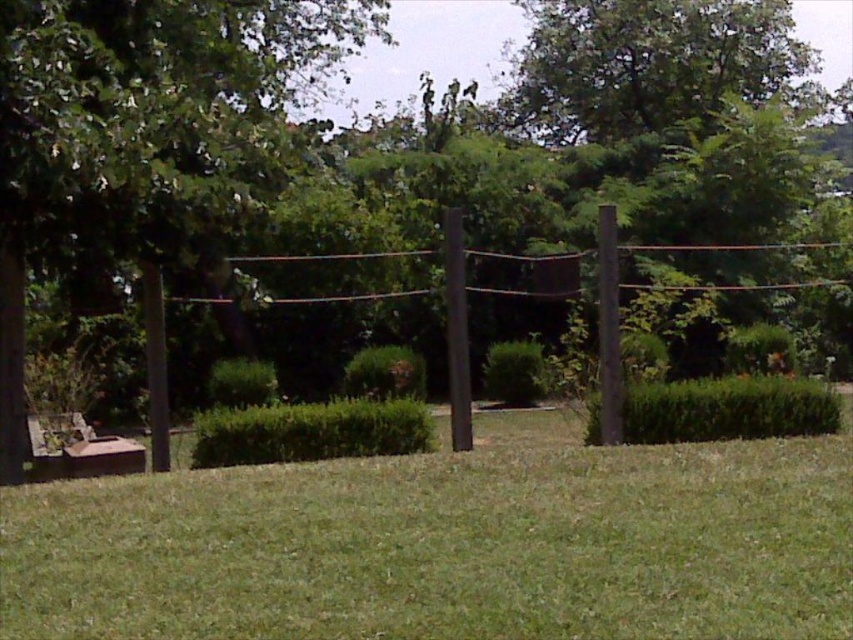
How distant is black matte telegraph pole at center from brown wooden telegraph pole at right?

black matte telegraph pole at center is 4.59 meters away from brown wooden telegraph pole at right.

Is black matte telegraph pole at center thinner than brown wooden telegraph pole at right?

No, black matte telegraph pole at center is not thinner than brown wooden telegraph pole at right.

Who is more forward, [457,337] or [601,406]?

Point [457,337] is more forward.

The width and height of the screenshot is (853, 640). Identify the location of black matte telegraph pole at center. (457, 332).

Does point (3, 310) come farther from viewer compared to point (141, 269)?

That is False.

Which of these two, green leafy tree at left or smooth brown post at left, stands taller?

With more height is green leafy tree at left.

Between point (231, 176) and point (165, 458), which one is positioned in front?

Point (231, 176) is more forward.

Where is `green leafy tree at left`? The width and height of the screenshot is (853, 640). green leafy tree at left is located at coordinates (141, 129).

Is green leafy tree at left positioned before black matte telegraph pole at center?

That is True.

Describe the element at coordinates (141, 129) in the screenshot. I see `green leafy tree at left` at that location.

Locate an element on the screen. green leafy tree at left is located at coordinates (141, 129).

Where is `green leafy tree at left`? green leafy tree at left is located at coordinates (141, 129).